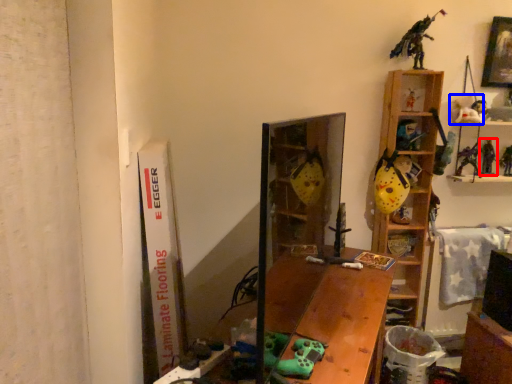
Question: Which object appears farthest to the camera in this image, toy (highlighted by a red box) or toy (highlighted by a blue box)?

Choices:
 (A) toy
 (B) toy

Answer: (A)